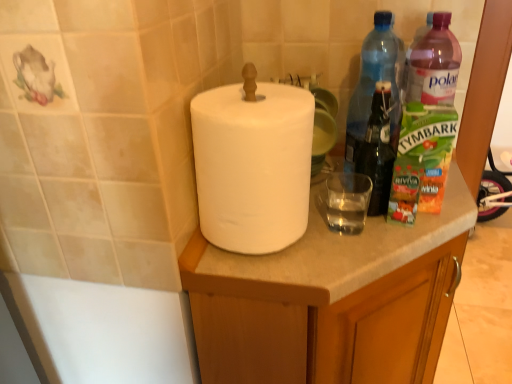
Locate an element on the screen. free space in front of pink plastic bottle at right, which ranks as the 2th bottle in left-to-right order is located at coordinates (411, 226).